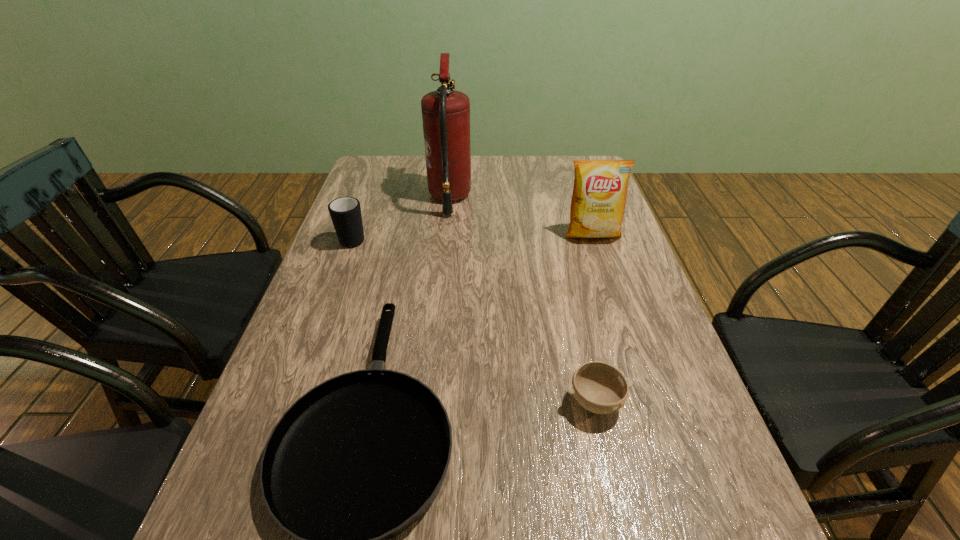
At what (x,y) coordinates should I click in order to perform the action: click on free spot located 0.280m on the back of the bowl. Please return your answer as a coordinate pair (x, y). Looking at the image, I should click on coord(569,287).

Locate an element on the screen. Image resolution: width=960 pixels, height=540 pixels. object situated at the far edge is located at coordinates (445, 112).

Image resolution: width=960 pixels, height=540 pixels. Identify the location of object that is at the left edge. (345, 212).

Locate an element on the screen. crisp (potato chip) located at the right edge is located at coordinates (598, 201).

Locate an element on the screen. The width and height of the screenshot is (960, 540). bowl present at the right edge is located at coordinates (600, 388).

This screenshot has height=540, width=960. I want to click on vacant space at the far edge of the desktop, so click(x=509, y=187).

Identify the location of vacant space at the left edge of the desktop. (385, 206).

Locate an element on the screen. free space at the right edge is located at coordinates (599, 282).

Identify the location of vacant region between the fourth shortest object and the tallest object. (521, 216).

Where is `free point between the mug and the fire extinguisher`? The width and height of the screenshot is (960, 540). free point between the mug and the fire extinguisher is located at coordinates (401, 218).